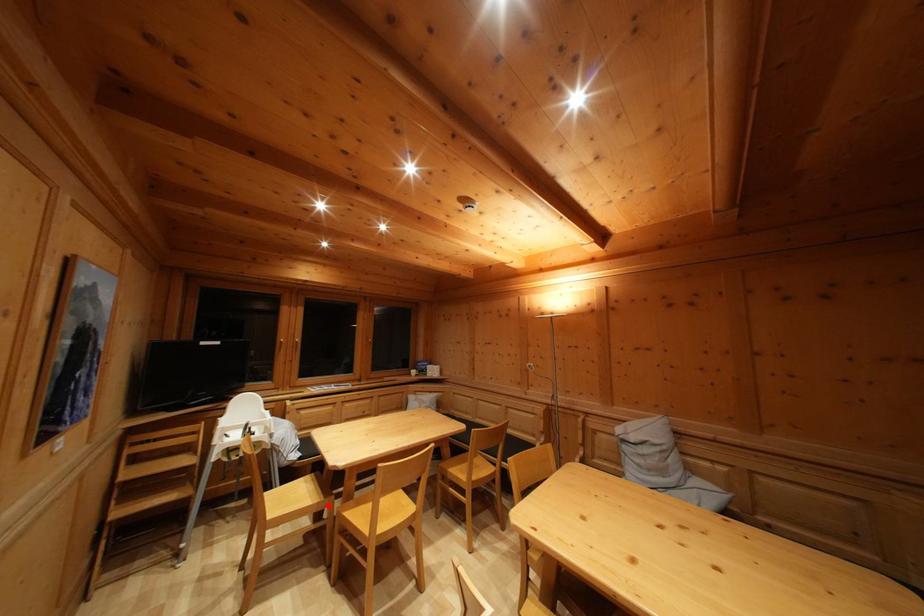
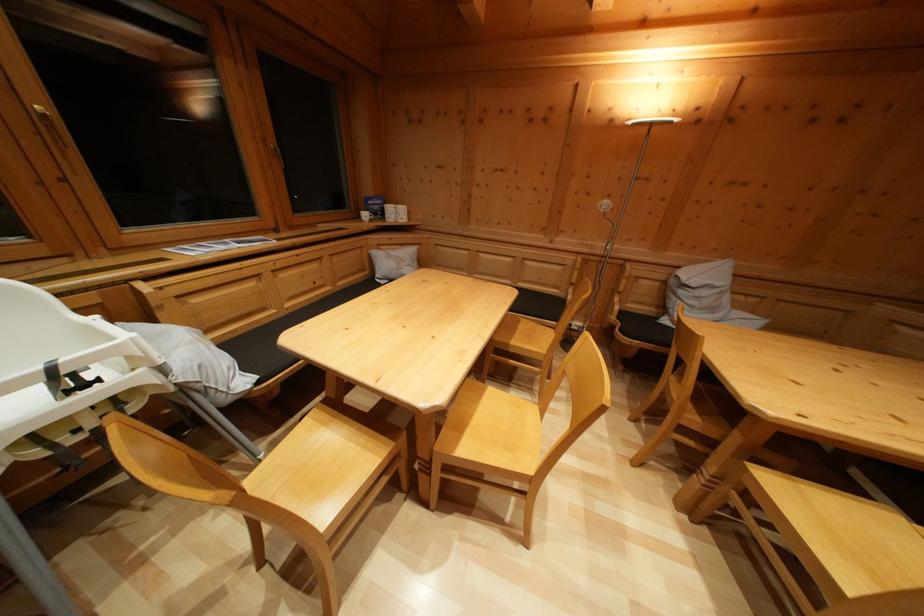
Find the pixel in the second image that matches the highlighted location in the first image.

(398, 451)